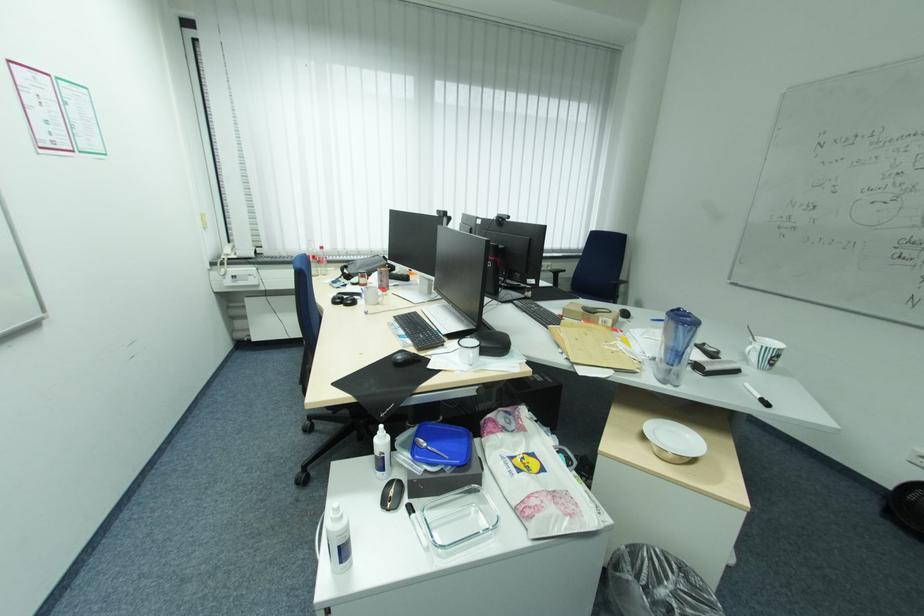
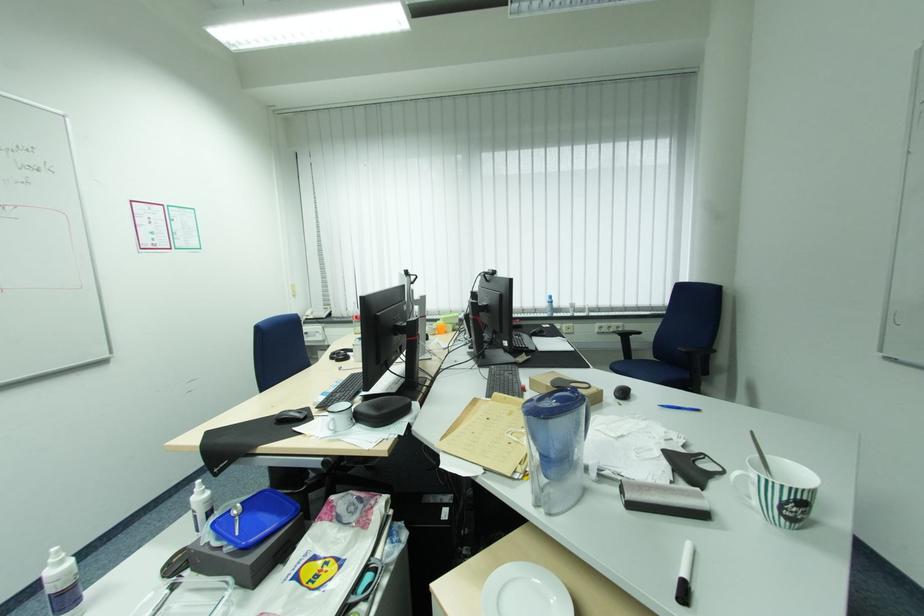
Find the pixel in the second image that matches pixel 406 361 in the first image.

(286, 418)